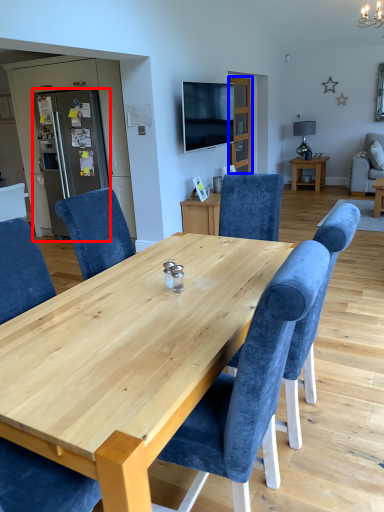
Question: Which point is closer to the camera, refrigerator (highlighted by a red box) or glass door (highlighted by a blue box)?

Choices:
 (A) refrigerator
 (B) glass door

Answer: (A)